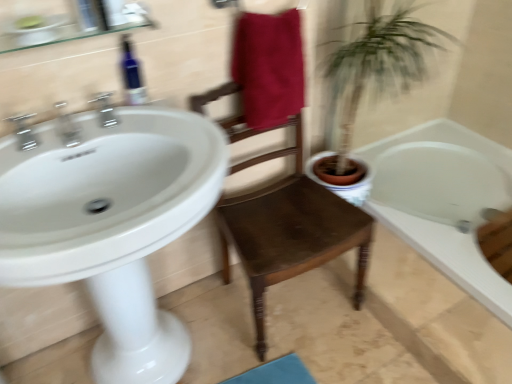
The image size is (512, 384). What do you see at coordinates (104, 109) in the screenshot? I see `silver metallic faucet at upper left, the first tap in the right-to-left sequence` at bounding box center [104, 109].

This screenshot has width=512, height=384. Describe the element at coordinates (269, 67) in the screenshot. I see `maroon fabric towel at center` at that location.

The height and width of the screenshot is (384, 512). Describe the element at coordinates (287, 227) in the screenshot. I see `brown wooden chair at center` at that location.

You are a GUI agent. You are given a task and a screenshot of the screen. Output one action in this format:
    pyautogui.click(x=<x>, y=<y>)
    Task: Click on the white glossy sink at left
    
    Given the screenshot: What is the action you would take?
    pyautogui.click(x=112, y=224)

Identify the location of chrome metallic faucet at upper left, acting as the 2th tap starting from the left. (67, 126).

From the image's perspective, between maroon fabric towel at center and white glossy bathtub at lower right, who is located below?

white glossy bathtub at lower right, from the image's perspective.

From a real-world perspective, between maroon fabric towel at center and white glossy bathtub at lower right, who is vertically higher?

From a 3D spatial view, maroon fabric towel at center is above.

Is maroon fabric towel at center spatially inside white glossy bathtub at lower right, or outside of it?

maroon fabric towel at center lies outside white glossy bathtub at lower right.

Which point is more forward, (70, 133) or (19, 121)?

Positioned in front is point (19, 121).

This screenshot has height=384, width=512. What are the coordinates of `the 2nd tap directly beneath the chrome metallic faucet at upper left, which appears as the 3th tap when viewed from the right (from a real-world perspective)` in the screenshot? It's located at (67, 126).

Does chrome metallic faucet at upper left, acting as the 2th tap starting from the left, lie in front of chrome metallic faucet at upper left, positioned as the first tap in left-to-right order?

Yes, chrome metallic faucet at upper left, acting as the 2th tap starting from the left, is in front of chrome metallic faucet at upper left, positioned as the first tap in left-to-right order.

Who is smaller, chrome metallic faucet at upper left, acting as the 2th tap starting from the right, or chrome metallic faucet at upper left, positioned as the first tap in left-to-right order?

Smaller between the two is chrome metallic faucet at upper left, acting as the 2th tap starting from the right.

Is chrome metallic faucet at upper left, positioned as the first tap in left-to-right order, inside the boundaries of blue glass bottle at upper left, or outside?

chrome metallic faucet at upper left, positioned as the first tap in left-to-right order, lies outside blue glass bottle at upper left.

From the image's perspective, relative to blue glass bottle at upper left, is chrome metallic faucet at upper left, positioned as the first tap in left-to-right order, above or below?

From the image's perspective, chrome metallic faucet at upper left, positioned as the first tap in left-to-right order, appears below blue glass bottle at upper left.

Is chrome metallic faucet at upper left, positioned as the first tap in left-to-right order, next to blue glass bottle at upper left and touching it?

No, chrome metallic faucet at upper left, positioned as the first tap in left-to-right order, is not with blue glass bottle at upper left.

Does silver metallic faucet at upper left, acting as the third tap starting from the left, touch chrome metallic faucet at upper left, positioned as the first tap in left-to-right order?

silver metallic faucet at upper left, acting as the third tap starting from the left, and chrome metallic faucet at upper left, positioned as the first tap in left-to-right order, are clearly separated.

From the image's perspective, is silver metallic faucet at upper left, acting as the third tap starting from the left, located above or below chrome metallic faucet at upper left, positioned as the first tap in left-to-right order?

Clearly, from the image's perspective, silver metallic faucet at upper left, acting as the third tap starting from the left, is above chrome metallic faucet at upper left, positioned as the first tap in left-to-right order.

Which is behind, silver metallic faucet at upper left, the first tap in the right-to-left sequence, or chrome metallic faucet at upper left, positioned as the first tap in left-to-right order?

silver metallic faucet at upper left, the first tap in the right-to-left sequence, is further away from the camera.

Considering the sizes of silver metallic faucet at upper left, acting as the third tap starting from the left, and brown wooden chair at center in the image, is silver metallic faucet at upper left, acting as the third tap starting from the left, wider or thinner than brown wooden chair at center?

Clearly, silver metallic faucet at upper left, acting as the third tap starting from the left, has less width compared to brown wooden chair at center.

From a real-world perspective, is silver metallic faucet at upper left, the first tap in the right-to-left sequence, under brown wooden chair at center?

Incorrect, from a real-world perspective, silver metallic faucet at upper left, the first tap in the right-to-left sequence, is higher than brown wooden chair at center.

From the image's perspective, which one is positioned higher, silver metallic faucet at upper left, the first tap in the right-to-left sequence, or brown wooden chair at center?

silver metallic faucet at upper left, the first tap in the right-to-left sequence, appears higher in the image.

Does silver metallic faucet at upper left, the first tap in the right-to-left sequence, have a lesser height compared to brown wooden chair at center?

Yes.

Is chrome metallic faucet at upper left, acting as the 2th tap starting from the left, located outside white glossy bathtub at lower right?

Yes.

Who is taller, chrome metallic faucet at upper left, acting as the 2th tap starting from the left, or white glossy bathtub at lower right?

With more height is chrome metallic faucet at upper left, acting as the 2th tap starting from the left.

Considering the positions of point (62, 106) and point (449, 235), is point (62, 106) closer or farther from the camera than point (449, 235)?

Point (62, 106) is closer to the camera than point (449, 235).

From the image's perspective, which is below, chrome metallic faucet at upper left, acting as the 2th tap starting from the left, or white glossy bathtub at lower right?

From the image's view, white glossy bathtub at lower right is below.

Is blue glass bottle at upper left outside of maroon fabric towel at center?

Yes, blue glass bottle at upper left is outside of maroon fabric towel at center.

Could you tell me if blue glass bottle at upper left is turned towards maroon fabric towel at center?

No, blue glass bottle at upper left does not turn towards maroon fabric towel at center.

Which of these two, blue glass bottle at upper left or maroon fabric towel at center, is thinner?

With smaller width is blue glass bottle at upper left.

How many degrees apart are the facing directions of blue glass bottle at upper left and maroon fabric towel at center?

1.09 degrees separate the facing orientations of blue glass bottle at upper left and maroon fabric towel at center.

I want to click on bathtub that is below the maroon fabric towel at center (from the image's perspective), so (x=450, y=256).

Identify the location of tap that is the 1st object to the right of the chrome metallic faucet at upper left, positioned as the first tap in left-to-right order, starting at the anchor. (67, 126).

Considering their positions, is white glossy bathtub at lower right positioned further to brown wooden chair at center than maroon fabric towel at center?

The object further to brown wooden chair at center is white glossy bathtub at lower right.

Looking at the image, which one is located further to brown wooden chair at center, chrome metallic faucet at upper left, which appears as the 3th tap when viewed from the right, or chrome metallic faucet at upper left, acting as the 2th tap starting from the left?

chrome metallic faucet at upper left, which appears as the 3th tap when viewed from the right, lies further to brown wooden chair at center than the other object.

When comparing their distances from blue glass bottle at upper left, does chrome metallic faucet at upper left, positioned as the first tap in left-to-right order, or silver metallic faucet at upper left, acting as the third tap starting from the left, seem further?

chrome metallic faucet at upper left, positioned as the first tap in left-to-right order.

From the image, which object appears to be farther from white glossy bathtub at lower right, brown wooden chair at center or silver metallic faucet at upper left, the first tap in the right-to-left sequence?

silver metallic faucet at upper left, the first tap in the right-to-left sequence, is further to white glossy bathtub at lower right.

Looking at the image, which one is located further to white glossy bathtub at lower right, silver metallic faucet at upper left, acting as the third tap starting from the left, or blue glass bottle at upper left?

silver metallic faucet at upper left, acting as the third tap starting from the left, is positioned further to the anchor white glossy bathtub at lower right.

Estimate the real-world distances between objects in this image. Which object is closer to chrome metallic faucet at upper left, positioned as the first tap in left-to-right order, white glossy sink at left or maroon fabric towel at center?

white glossy sink at left is positioned closer to the anchor chrome metallic faucet at upper left, positioned as the first tap in left-to-right order.

Based on their spatial positions, is brown wooden chair at center or chrome metallic faucet at upper left, acting as the 2th tap starting from the left, closer to white glossy bathtub at lower right?

Among the two, brown wooden chair at center is located nearer to white glossy bathtub at lower right.

Estimate the real-world distances between objects in this image. Which object is closer to silver metallic faucet at upper left, acting as the third tap starting from the left, white glossy sink at left or blue glass bottle at upper left?

blue glass bottle at upper left lies closer to silver metallic faucet at upper left, acting as the third tap starting from the left, than the other object.

Where is `bath towel situated between silver metallic faucet at upper left, the first tap in the right-to-left sequence, and white glossy bathtub at lower right from left to right`? The width and height of the screenshot is (512, 384). bath towel situated between silver metallic faucet at upper left, the first tap in the right-to-left sequence, and white glossy bathtub at lower right from left to right is located at coordinates (269, 67).

Identify the location of tap between chrome metallic faucet at upper left, which appears as the 3th tap when viewed from the right, and white glossy sink at left from top to bottom. Image resolution: width=512 pixels, height=384 pixels. (67, 126).

I want to click on bath towel between chrome metallic faucet at upper left, acting as the 2th tap starting from the right, and white glossy bathtub at lower right, so click(269, 67).

This screenshot has height=384, width=512. Identify the location of chair between chrome metallic faucet at upper left, which appears as the 3th tap when viewed from the right, and white glossy bathtub at lower right from left to right. (287, 227).